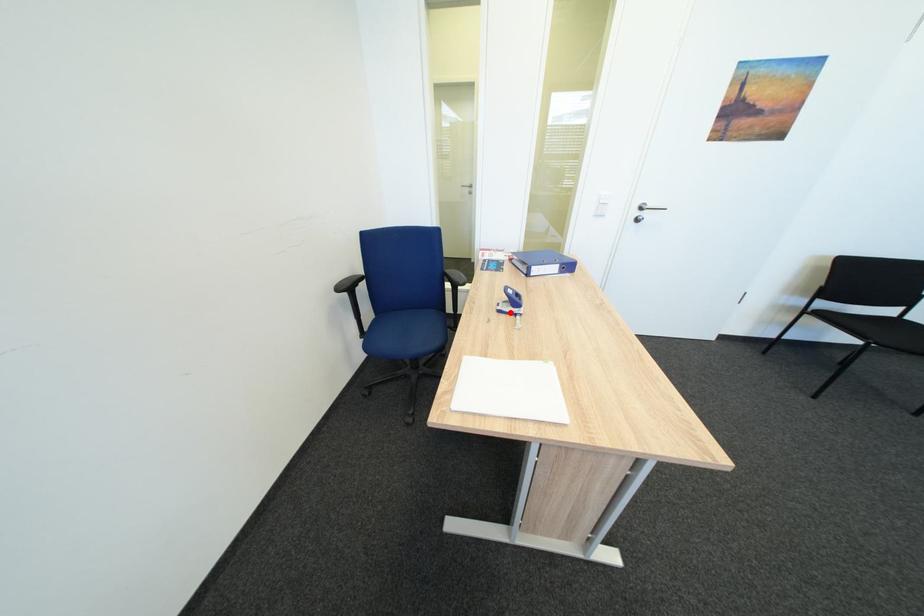
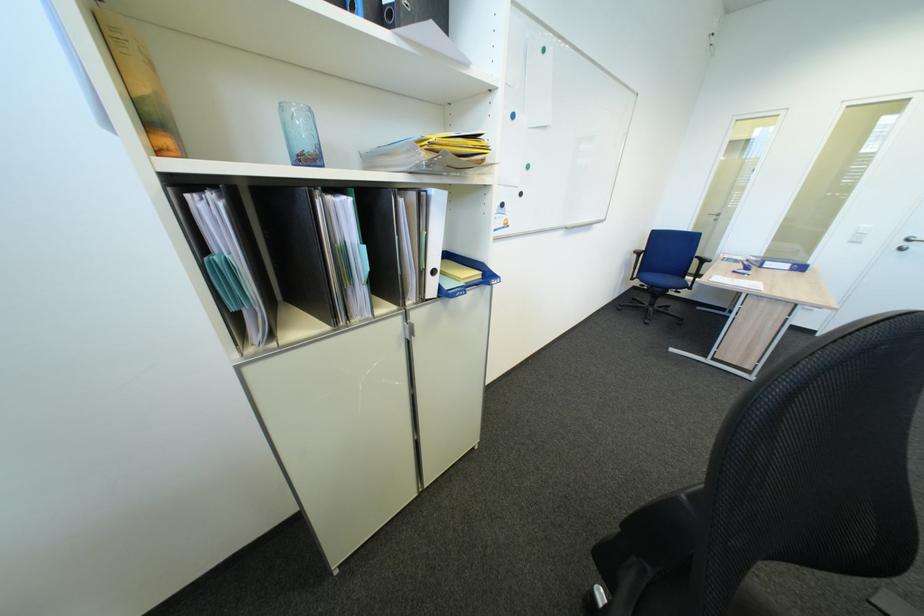
Locate, in the second image, the point that corresponds to the highlighted location in the first image.

(745, 274)